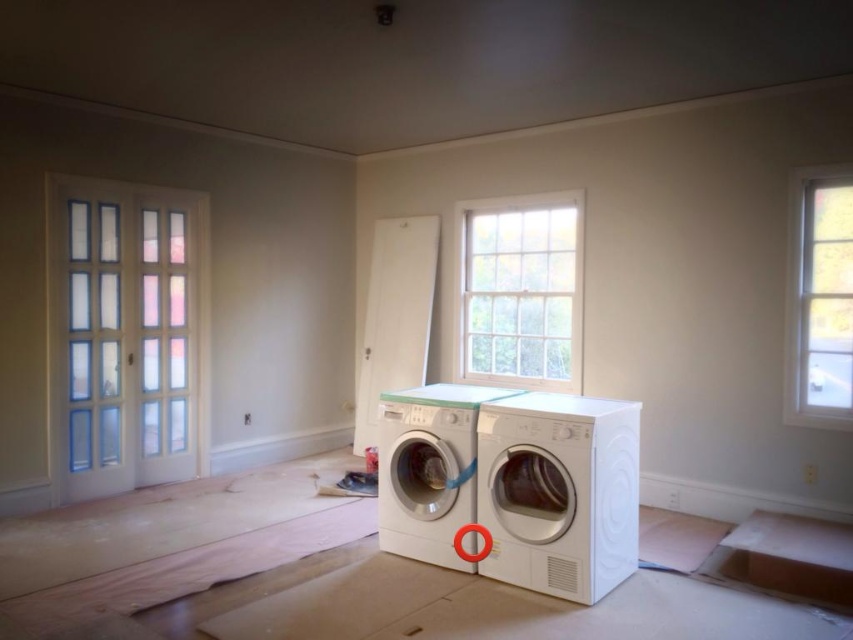
Based on the photo, you are standing in the center of the room and want to reach the highlighted red circle on the dryer. Which point, point (532, 566) or point (448, 419), is closer to the red circle?

Point (532, 566) is closer to the red circle on the dryer since it is in front of point (448, 419), meaning it is positioned between the observer and the dryer.

You are moving a large piece of furniture that is 7 feet wide. You need to move it through the space between the white glossy washing machine at center and the clear glass window at upper right. Will it fit through the space?

The distance between the white glossy washing machine at center and the clear glass window at upper right is 7.25 feet. Since the furniture is 7 feet wide, it will fit through the space as there is enough clearance.

You are an interior designer inspecting the renovation site. You need to place a new decorative item exactly at point (428, 468). What object will be at that location?

The white glossy washing machine at center is located at point (428, 468).